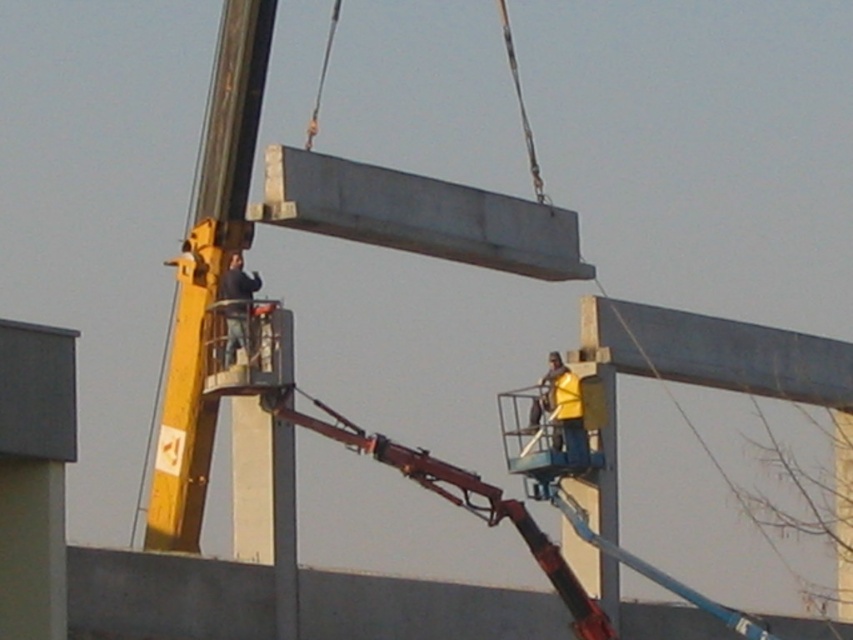
You are a safety inspector observing the construction site. You notice the metallic gray beam at upper right and the dark blue jeans at upper center. Which object is bigger in size?

The metallic gray beam at upper right has a larger size compared to the dark blue jeans at upper center.